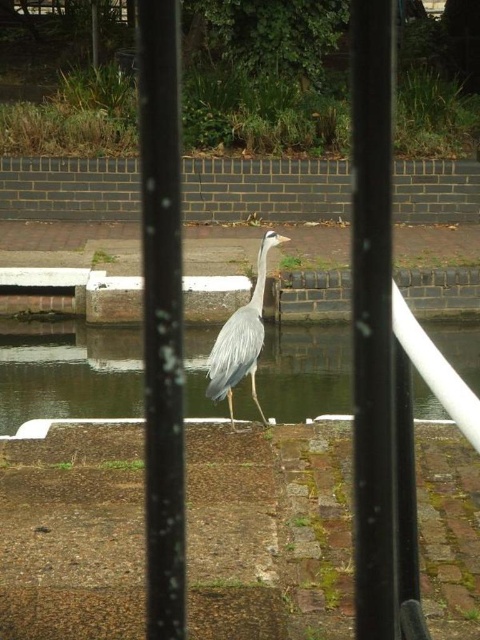
Is point (442, 344) closer to camera compared to point (242, 330)?

No.

What do you see at coordinates (70, 374) in the screenshot?
I see `clear water at center` at bounding box center [70, 374].

Is point (68, 406) closer to viewer compared to point (236, 369)?

No, (68, 406) is behind (236, 369).

Find the location of a particular element. The image size is (480, 640). clear water at center is located at coordinates tap(70, 374).